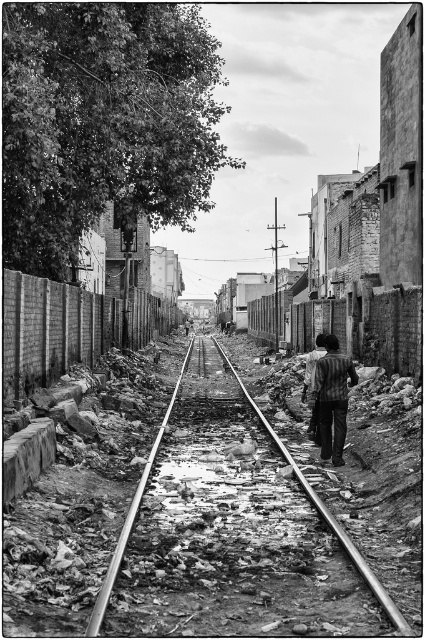
From the picture: You are a painter standing at the edge of the railway pathway. You see the smooth metal track at center and the striped shirt at center. Which object is closer to the ground?

The smooth metal track at center is shorter than the striped shirt at center, so the smooth metal track at center is closer to the ground.

You are a pedestrian walking along the repurposed railway path. You notice the smooth metal track at center and the striped shirt at center in the scene. Which object is nearer to you as you walk towards the tracks?

The smooth metal track at center is closer to the viewer than the striped shirt at center, so the smooth metal track at center is nearer to you.